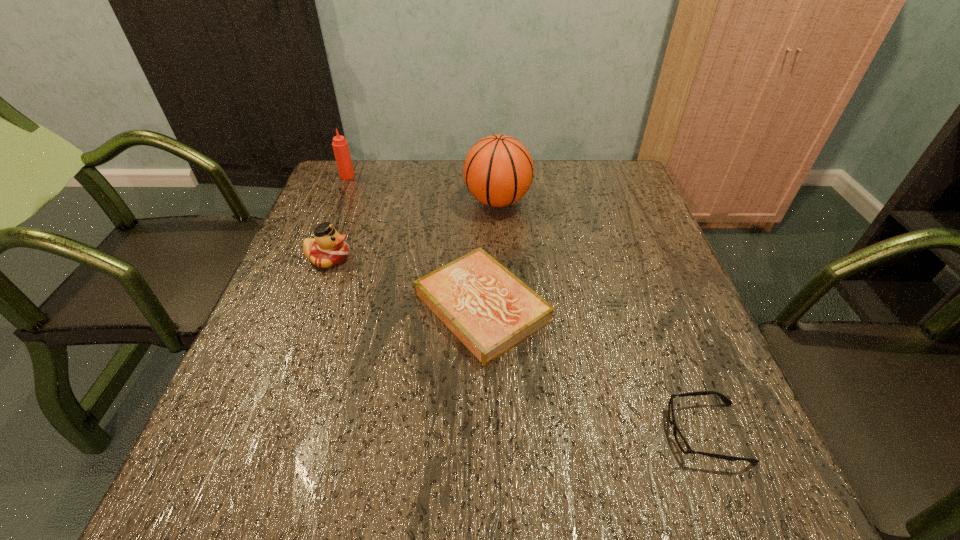
Identify which object is the fourth closest to the rightmost object. Please provide its 2D coordinates. Your answer should be formatted as a tuple, i.e. [(x, y)], where the tuple contains the x and y coordinates of a point satisfying the conditions above.

[(340, 146)]